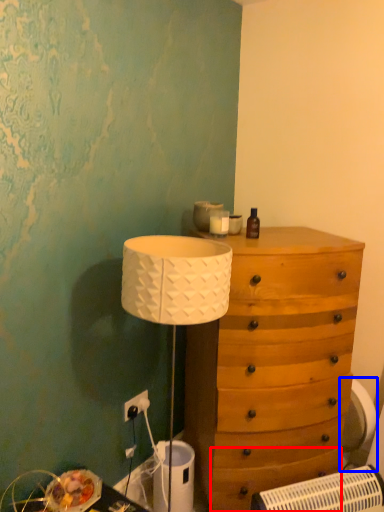
Question: Among these objects, which one is farthest to the camera, drawer (highlighted by a red box) or swivel chair (highlighted by a blue box)?

Choices:
 (A) drawer
 (B) swivel chair

Answer: (B)